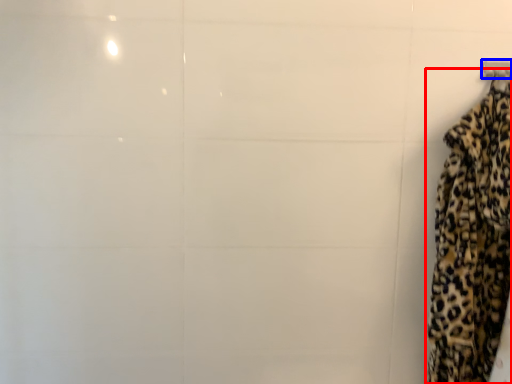
Question: Which object appears closest to the camera in this image, curtain (highlighted by a red box) or hanger (highlighted by a blue box)?

Choices:
 (A) curtain
 (B) hanger

Answer: (A)